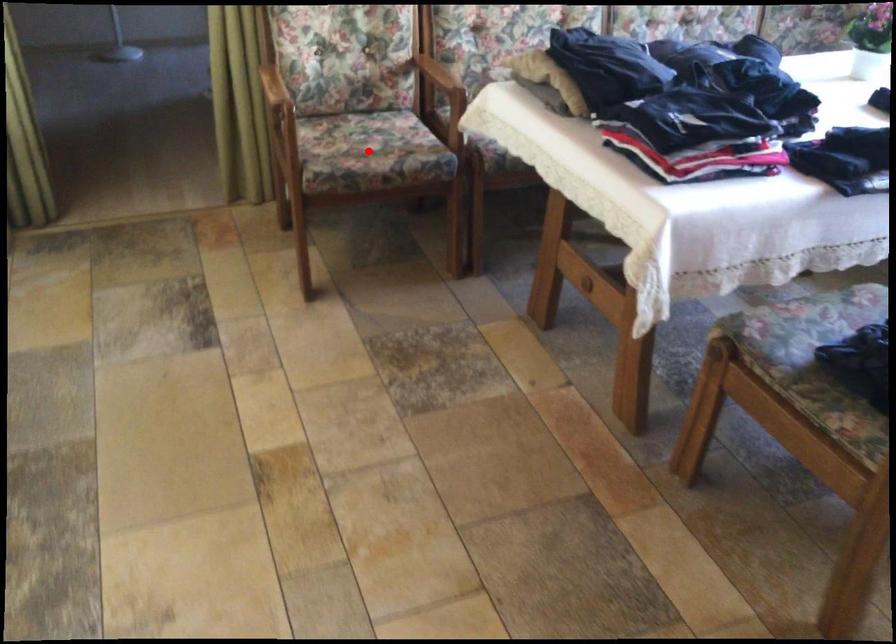
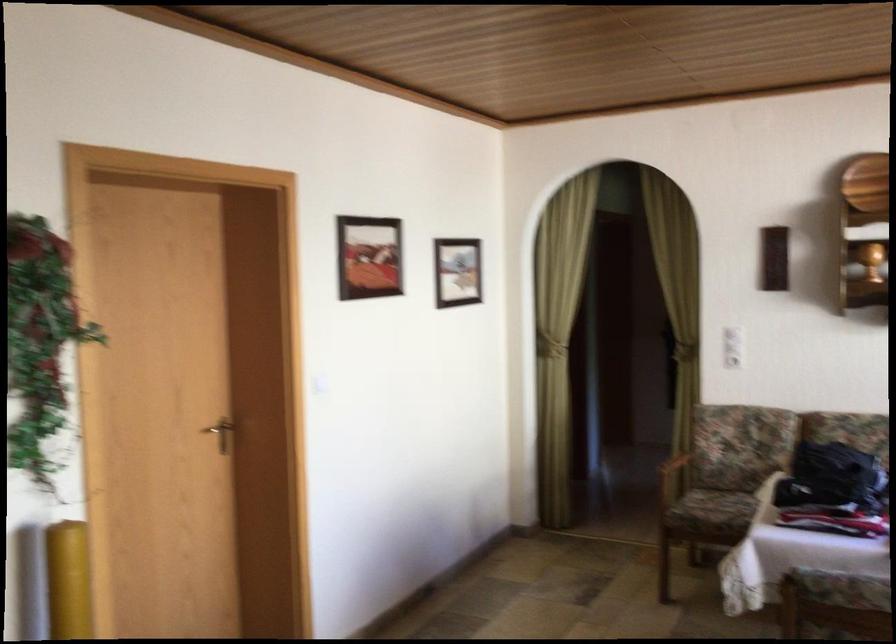
Question: I am providing you with two images of the same scene from different viewpoints. In image1, a red point is highlighted. Considering the same 3D point in image2, which of the following is correct?

Choices:
 (A) It is closer
 (B) It is farther

Answer: (B)